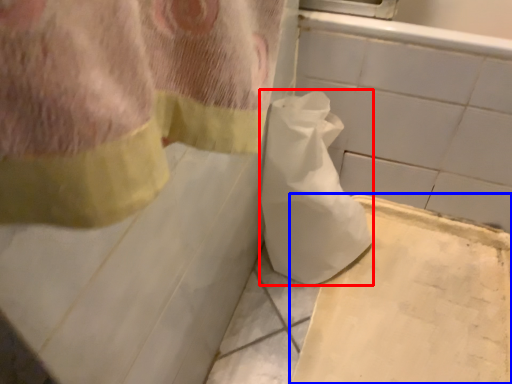
Question: Which object appears farthest to the camera in this image, toilet paper (highlighted by a red box) or cardboard (highlighted by a blue box)?

Choices:
 (A) toilet paper
 (B) cardboard

Answer: (B)